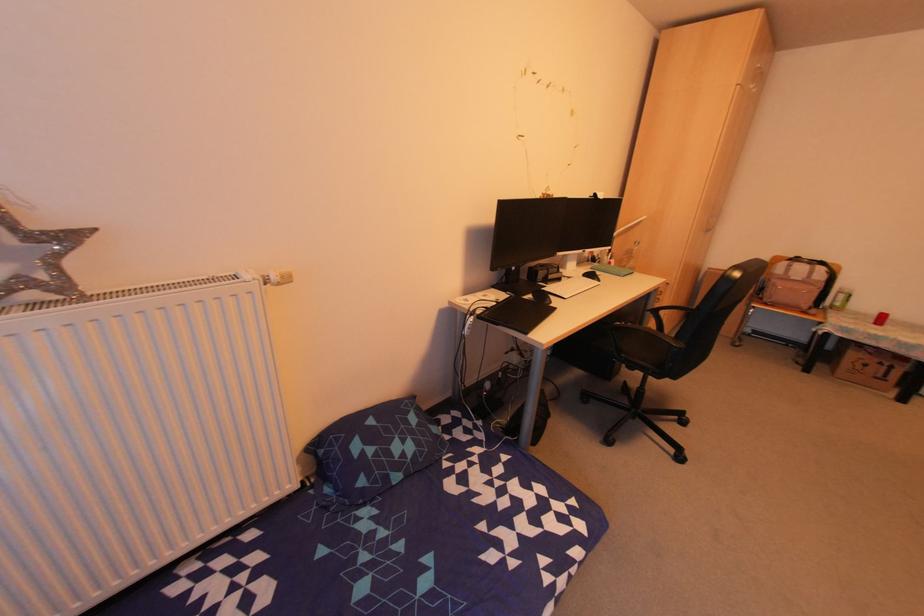
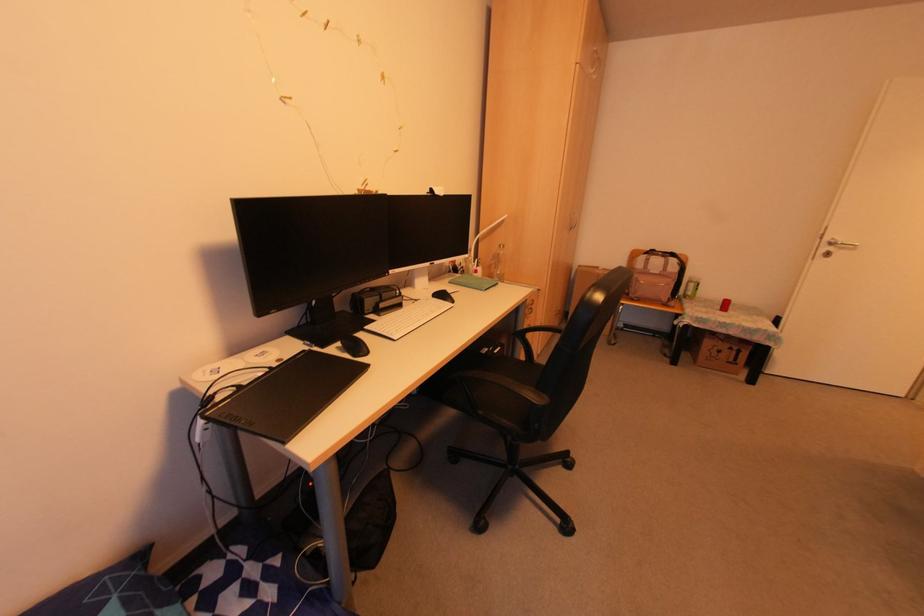
Where in the second image is the point corresponding to the point at 561,91 from the first image?

(358, 41)